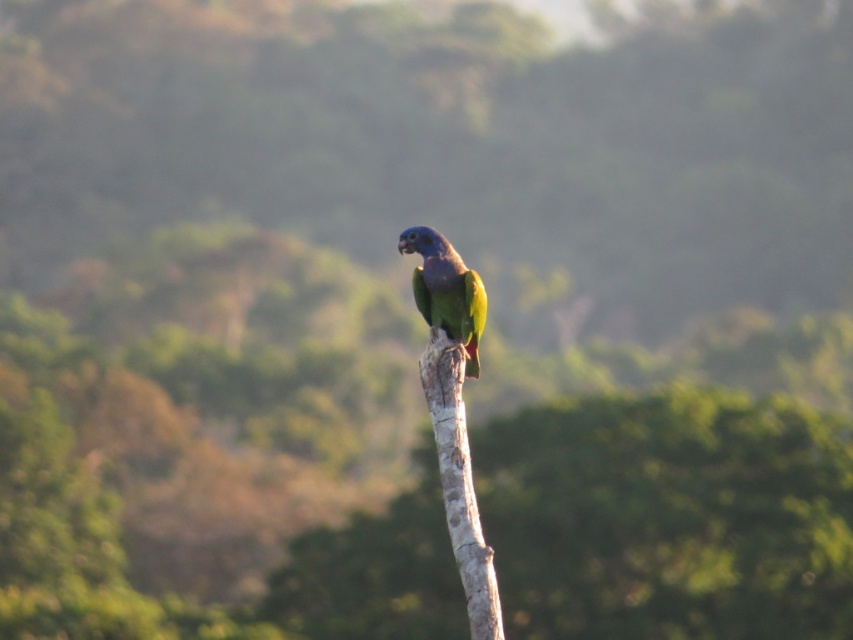
Question: Can you confirm if smooth bark tree branch at center is smaller than green matte parrot at center?

Choices:
 (A) no
 (B) yes

Answer: (A)

Question: Is smooth bark tree branch at center wider than green matte parrot at center?

Choices:
 (A) no
 (B) yes

Answer: (A)

Question: Which object is farther from the camera taking this photo?

Choices:
 (A) smooth bark tree branch at center
 (B) green matte parrot at center

Answer: (B)

Question: Among these objects, which one is farthest from the camera?

Choices:
 (A) green matte parrot at center
 (B) smooth bark tree branch at center

Answer: (A)

Question: Which object is farther from the camera taking this photo?

Choices:
 (A) smooth bark tree branch at center
 (B) green matte parrot at center

Answer: (B)

Question: Does smooth bark tree branch at center appear over green matte parrot at center?

Choices:
 (A) no
 (B) yes

Answer: (A)